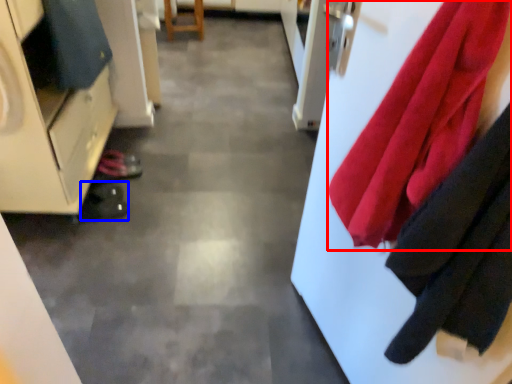
Question: Which of the following is the closest to the observer, cloth (highlighted by a red box) or shoe (highlighted by a blue box)?

Choices:
 (A) cloth
 (B) shoe

Answer: (A)